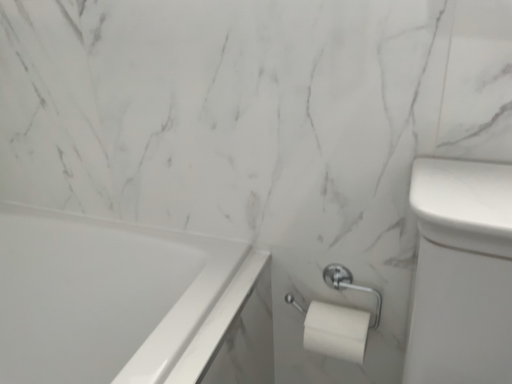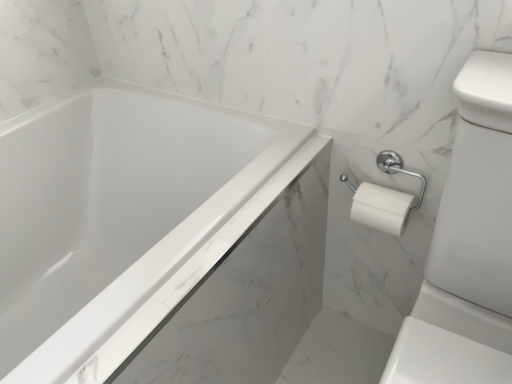
Question: Which way did the camera rotate in the video?

Choices:
 (A) rotated left
 (B) rotated right

Answer: (A)